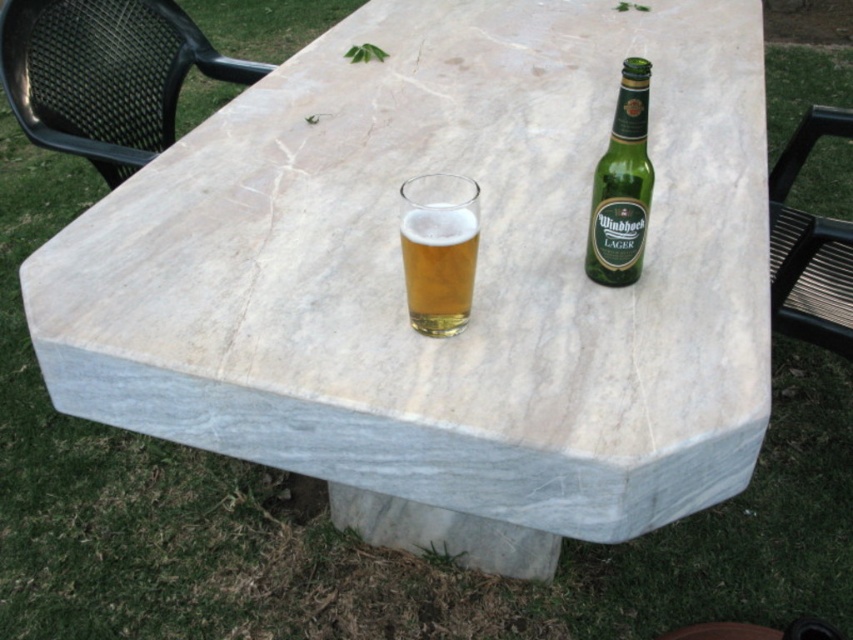
Question: Estimate the real-world distances between objects in this image. Which object is farther from the black plastic chair at right?

Choices:
 (A) black mesh chair at upper left
 (B) green glass bottle at upper right

Answer: (A)

Question: Which point appears farthest from the camera in this image?

Choices:
 (A) (625, 216)
 (B) (73, 65)
 (C) (407, 250)

Answer: (B)

Question: Does black mesh chair at upper left appear under black plastic chair at right?

Choices:
 (A) no
 (B) yes

Answer: (A)

Question: Which point is closer to the camera taking this photo?

Choices:
 (A) (428, 180)
 (B) (639, 140)

Answer: (B)

Question: Is black plastic chair at right thinner than translucent glass at center?

Choices:
 (A) no
 (B) yes

Answer: (A)

Question: Does black mesh chair at upper left have a smaller size compared to black plastic chair at right?

Choices:
 (A) yes
 (B) no

Answer: (A)